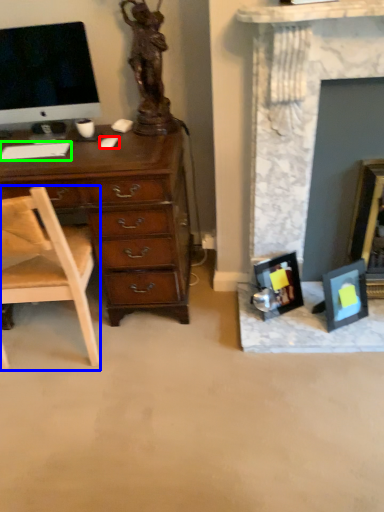
Question: Considering the real-world distances, which object is farthest from computer mouse (highlighted by a red box)? chair (highlighted by a blue box) or computer keyboard (highlighted by a green box)?

Choices:
 (A) chair
 (B) computer keyboard

Answer: (A)